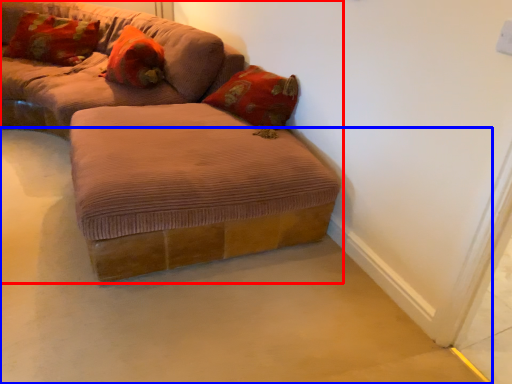
Question: Which point is further to the camera, studio couch (highlighted by a red box) or concrete (highlighted by a blue box)?

Choices:
 (A) studio couch
 (B) concrete

Answer: (A)